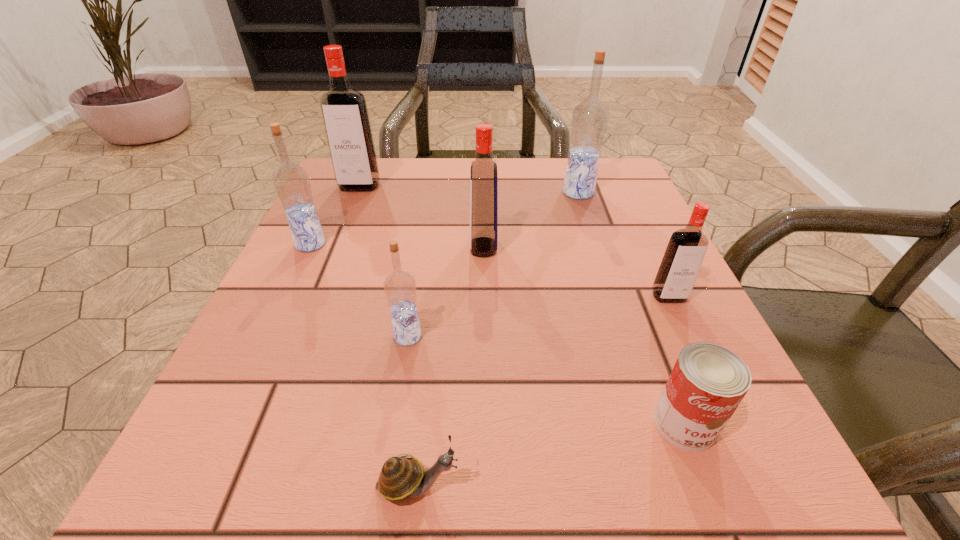
Where is `vacant region located on the front and back of the second biggest red vodka`? The image size is (960, 540). vacant region located on the front and back of the second biggest red vodka is located at coordinates (387, 247).

Identify the location of vacant region located 0.150m on the right of the leftmost blue vodka. (402, 244).

Locate an element on the screen. This screenshot has height=540, width=960. vacant space located 0.230m on the front and back of the smallest red vodka is located at coordinates (732, 431).

Identify the location of vacant position located on the right of the second blue vodka from left to right. This screenshot has width=960, height=540. (629, 336).

This screenshot has width=960, height=540. Find the location of `vacant space located 0.070m on the front label of the seventh farthest object`. vacant space located 0.070m on the front label of the seventh farthest object is located at coordinates (718, 513).

At what (x,y) coordinates should I click in order to perform the action: click on vacant space located 0.290m on the face of the nearest object. Please return your answer as a coordinate pair (x, y). The height and width of the screenshot is (540, 960). Looking at the image, I should click on (709, 485).

This screenshot has width=960, height=540. What are the coordinates of `can that is at the near edge` in the screenshot? It's located at (708, 382).

Find the location of a particular element. Image resolution: width=960 pixels, height=540 pixels. snail that is at the near edge is located at coordinates 400,478.

Where is `can at the right edge`? can at the right edge is located at coordinates (708, 382).

Locate an element on the screen. object present at the far left corner is located at coordinates (344, 109).